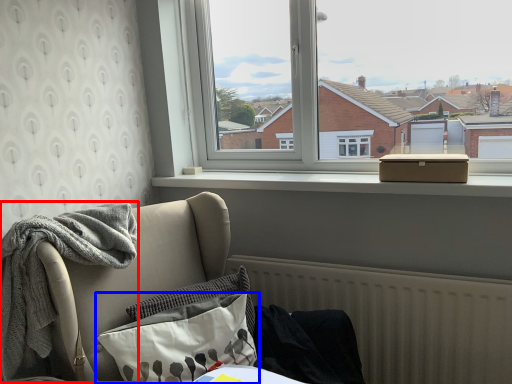
Question: Which object appears farthest to the camera in this image, material (highlighted by a red box) or pillow (highlighted by a blue box)?

Choices:
 (A) material
 (B) pillow

Answer: (B)